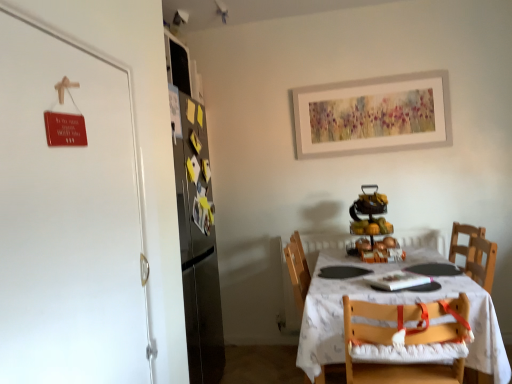
Question: Is metallic refrigerator at upper left surrounded by wooden chair with white cushion at lower right?

Choices:
 (A) yes
 (B) no

Answer: (B)

Question: Is wooden chair with white cushion at lower right at the right side of metallic refrigerator at upper left?

Choices:
 (A) yes
 (B) no

Answer: (A)

Question: Is wooden chair with white cushion at lower right shorter than metallic refrigerator at upper left?

Choices:
 (A) yes
 (B) no

Answer: (B)

Question: Could you tell me if wooden chair with white cushion at lower right is facing metallic refrigerator at upper left?

Choices:
 (A) yes
 (B) no

Answer: (B)

Question: Can you confirm if wooden chair with white cushion at lower right is bigger than metallic refrigerator at upper left?

Choices:
 (A) yes
 (B) no

Answer: (A)

Question: From a real-world perspective, does wooden chair with white cushion at lower right stand above metallic refrigerator at upper left?

Choices:
 (A) yes
 (B) no

Answer: (B)

Question: Is white cloth-covered table at center closer to camera compared to white matte door at left?

Choices:
 (A) yes
 (B) no

Answer: (B)

Question: Is the position of white cloth-covered table at center more distant than that of white matte door at left?

Choices:
 (A) no
 (B) yes

Answer: (B)

Question: Considering the relative sizes of white cloth-covered table at center and white matte door at left in the image provided, is white cloth-covered table at center bigger than white matte door at left?

Choices:
 (A) no
 (B) yes

Answer: (B)

Question: Considering the relative sizes of white cloth-covered table at center and white matte door at left in the image provided, is white cloth-covered table at center wider than white matte door at left?

Choices:
 (A) yes
 (B) no

Answer: (A)

Question: Is white cloth-covered table at center taller than white matte door at left?

Choices:
 (A) yes
 (B) no

Answer: (B)

Question: Is white cloth-covered table at center not close to white matte door at left?

Choices:
 (A) no
 (B) yes

Answer: (B)

Question: Considering the relative positions of metallic refrigerator at upper left and shiny metallic fruit stand at center in the image provided, is metallic refrigerator at upper left in front of shiny metallic fruit stand at center?

Choices:
 (A) yes
 (B) no

Answer: (B)